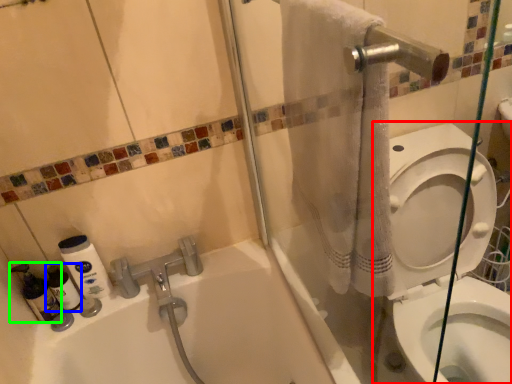
Question: Which object is positioned farthest from toilet (highlighted by a red box)? Select from cleaning product (highlighted by a blue box) and cleaning product (highlighted by a green box).

Choices:
 (A) cleaning product
 (B) cleaning product

Answer: (B)